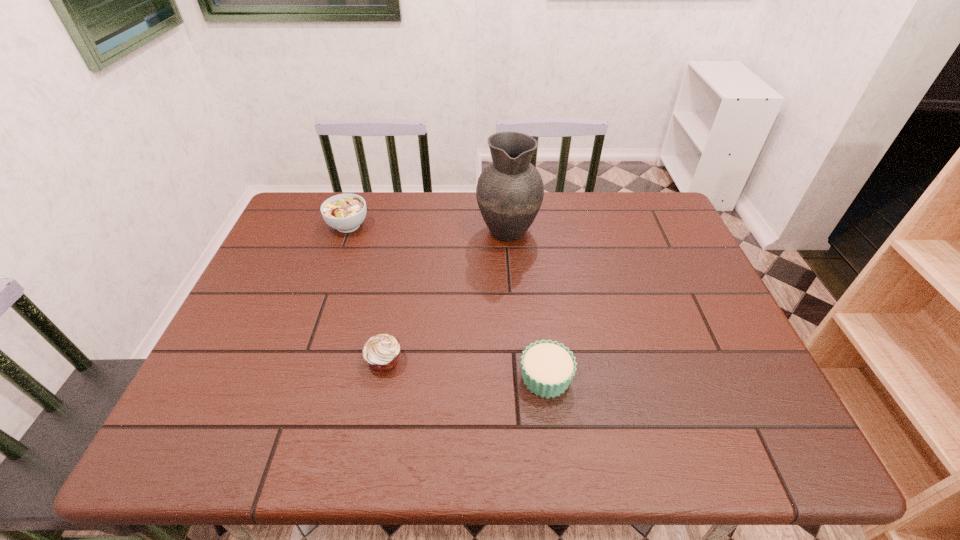
Image resolution: width=960 pixels, height=540 pixels. Identify the location of object that is at the left edge. (345, 212).

Locate an element on the screen. object that is at the far left corner is located at coordinates (345, 212).

Image resolution: width=960 pixels, height=540 pixels. I want to click on free point at the far edge, so coord(414,208).

Where is `vacant space at the near edge of the desktop`? This screenshot has width=960, height=540. vacant space at the near edge of the desktop is located at coordinates (466, 447).

Find the location of `free space at the left edge of the desktop`. free space at the left edge of the desktop is located at coordinates (228, 396).

You are a GUI agent. You are given a task and a screenshot of the screen. Output one action in this format:
    pyautogui.click(x=<x>, y=<y>)
    Task: Click on the vacant space at the right edge of the desktop
    
    Given the screenshot: What is the action you would take?
    (672, 336)

Locate an element on the screen. vacant space at the far left corner of the desktop is located at coordinates (288, 228).

Locate an element on the screen. blank space at the near right corner of the desktop is located at coordinates (794, 445).

This screenshot has height=540, width=960. Identify the location of free spot between the leftmost object and the pitcher. (428, 227).

The width and height of the screenshot is (960, 540). What are the coordinates of `free spot between the soup bowl and the cupcake` in the screenshot? It's located at (447, 302).